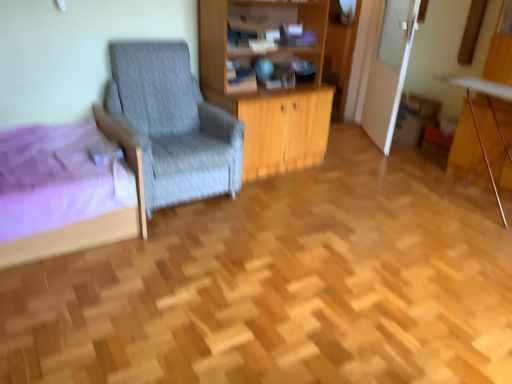
Question: From their relative heights in the image, would you say purple fabric bed at lower left is taller or shorter than wooden desk at right?

Choices:
 (A) tall
 (B) short

Answer: (B)

Question: From a real-world perspective, is purple fabric bed at lower left above or below wooden desk at right?

Choices:
 (A) below
 (B) above

Answer: (A)

Question: Estimate the real-world distances between objects in this image. Which object is closer to the gray fabric chair at left?

Choices:
 (A) purple fabric bed at lower left
 (B) wooden desk at right
 (C) wooden cabinet at center

Answer: (C)

Question: Which of these objects is positioned farthest from the purple fabric bed at lower left?

Choices:
 (A) wooden cabinet at center
 (B) wooden desk at right
 (C) gray fabric chair at left

Answer: (B)